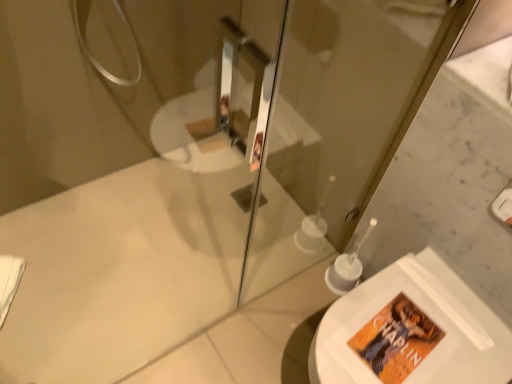
Describe the element at coordinates (425, 317) in the screenshot. The image size is (512, 384). I see `white glossy toilet at lower right` at that location.

Measure the distance between white glossy toilet at lower right and camera.

white glossy toilet at lower right is 94.29 centimeters from camera.

This screenshot has width=512, height=384. Find the location of `white glossy toilet at lower right`. white glossy toilet at lower right is located at coordinates (425, 317).

I want to click on transparent glass screen door at upper center, so click(x=333, y=123).

The width and height of the screenshot is (512, 384). What do you see at coordinates (333, 123) in the screenshot? I see `transparent glass screen door at upper center` at bounding box center [333, 123].

Measure the distance between transparent glass screen door at upper center and camera.

transparent glass screen door at upper center is 35.89 inches away from camera.

Identify the location of white glossy toilet at lower right. The height and width of the screenshot is (384, 512). (425, 317).

Is transparent glass screen door at upper center to the right of white glossy toilet at lower right from the viewer's perspective?

No, transparent glass screen door at upper center is not to the right of white glossy toilet at lower right.

Relative to white glossy toilet at lower right, is transparent glass screen door at upper center in front or behind?

transparent glass screen door at upper center is positioned closer to the viewer than white glossy toilet at lower right.

Is point (429, 60) in front of point (310, 378)?

No, (429, 60) is behind (310, 378).

From the image's perspective, which is above, transparent glass screen door at upper center or white glossy toilet at lower right?

From the image's view, transparent glass screen door at upper center is above.

From a real-world perspective, is transparent glass screen door at upper center positioned above or below white glossy toilet at lower right?

In terms of real-world spatial position, transparent glass screen door at upper center is above white glossy toilet at lower right.

Is transparent glass screen door at upper center wider or thinner than white glossy toilet at lower right?

Clearly, transparent glass screen door at upper center has less width compared to white glossy toilet at lower right.

Can you confirm if transparent glass screen door at upper center is taller than white glossy toilet at lower right?

Indeed, transparent glass screen door at upper center has a greater height compared to white glossy toilet at lower right.

Does transparent glass screen door at upper center have a smaller size compared to white glossy toilet at lower right?

Yes.

Choose the correct answer: Is transparent glass screen door at upper center inside white glossy toilet at lower right or outside it?

transparent glass screen door at upper center is outside white glossy toilet at lower right.

Is transparent glass screen door at upper center directly adjacent to white glossy toilet at lower right?

transparent glass screen door at upper center is not next to white glossy toilet at lower right, and they're not touching.

Is transparent glass screen door at upper center turned away from white glossy toilet at lower right?

transparent glass screen door at upper center is not turned away from white glossy toilet at lower right.

Identify the location of toilet behind the transparent glass screen door at upper center. (425, 317).

Considering the positions of objects white glossy toilet at lower right and transparent glass screen door at upper center in the image provided, who is more to the right, white glossy toilet at lower right or transparent glass screen door at upper center?

white glossy toilet at lower right is more to the right.

Is white glossy toilet at lower right closer to camera compared to transparent glass screen door at upper center?

Answer: No, white glossy toilet at lower right is further to the viewer.

Considering the points (431, 293) and (325, 48), which point is behind, point (431, 293) or point (325, 48)?

The point (325, 48) is farther from the camera.

From the image's perspective, would you say white glossy toilet at lower right is shown under transparent glass screen door at upper center?

Yes, from the image's perspective, white glossy toilet at lower right is beneath transparent glass screen door at upper center.

From a real-world perspective, is white glossy toilet at lower right beneath transparent glass screen door at upper center?

Yes.

In terms of width, does white glossy toilet at lower right look wider or thinner when compared to transparent glass screen door at upper center?

In the image, white glossy toilet at lower right appears to be wider than transparent glass screen door at upper center.

Can you confirm if white glossy toilet at lower right is shorter than transparent glass screen door at upper center?

Yes, white glossy toilet at lower right is shorter than transparent glass screen door at upper center.

In terms of size, does white glossy toilet at lower right appear bigger or smaller than transparent glass screen door at upper center?

Considering their sizes, white glossy toilet at lower right takes up more space than transparent glass screen door at upper center.

Is white glossy toilet at lower right positioned beyond the bounds of transparent glass screen door at upper center?

Yes, white glossy toilet at lower right is not within transparent glass screen door at upper center.

Would you say white glossy toilet at lower right is a long distance from transparent glass screen door at upper center?

white glossy toilet at lower right is actually quite close to transparent glass screen door at upper center.

Is white glossy toilet at lower right looking in the opposite direction of transparent glass screen door at upper center?

No, white glossy toilet at lower right is not facing the opposite direction of transparent glass screen door at upper center.

How many degrees apart are the facing directions of white glossy toilet at lower right and transparent glass screen door at upper center?

They differ by 87.9 degrees in their facing directions.

At what (x,y) coordinates should I click in order to perform the action: click on screen door above the white glossy toilet at lower right (from a real-world perspective). Please return your answer as a coordinate pair (x, y). Image resolution: width=512 pixels, height=384 pixels. Looking at the image, I should click on (333, 123).

The height and width of the screenshot is (384, 512). Find the location of `toilet behind the transparent glass screen door at upper center`. toilet behind the transparent glass screen door at upper center is located at coordinates (425, 317).

The width and height of the screenshot is (512, 384). I want to click on screen door in front of the white glossy toilet at lower right, so click(x=333, y=123).